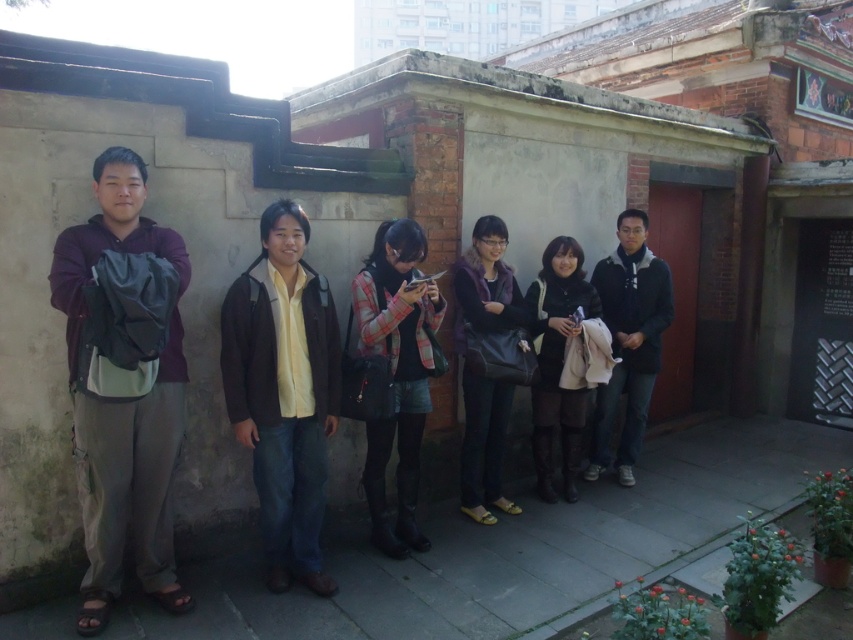
Between dark blue jacket at center and dark brown leather boots at center, which one appears on the left side from the viewer's perspective?

dark brown leather boots at center is more to the left.

Consider the image. Which of these two, dark blue jacket at center or dark brown leather boots at center, stands shorter?

Standing shorter between the two is dark brown leather boots at center.

Describe the element at coordinates (630, 339) in the screenshot. Image resolution: width=853 pixels, height=640 pixels. I see `dark blue jacket at center` at that location.

What are the coordinates of `dark blue jacket at center` in the screenshot? It's located at (630, 339).

Does dark purple fleece jacket at left have a lesser height compared to plaid fabric skirt at center?

No.

Is point (134, 388) positioned before point (378, 454)?

Yes, point (134, 388) is in front of point (378, 454).

At what (x,y) coordinates should I click in order to perform the action: click on dark purple fleece jacket at left. Please return your answer as a coordinate pair (x, y). Looking at the image, I should click on (123, 384).

Which of these two, dark blue jacket at center or purple fuzzy vest at center, stands shorter?

purple fuzzy vest at center is shorter.

Which is below, dark blue jacket at center or purple fuzzy vest at center?

purple fuzzy vest at center

Is point (662, 321) farther from camera compared to point (486, 317)?

Yes, point (662, 321) is farther from viewer.

I want to click on dark blue jacket at center, so click(x=630, y=339).